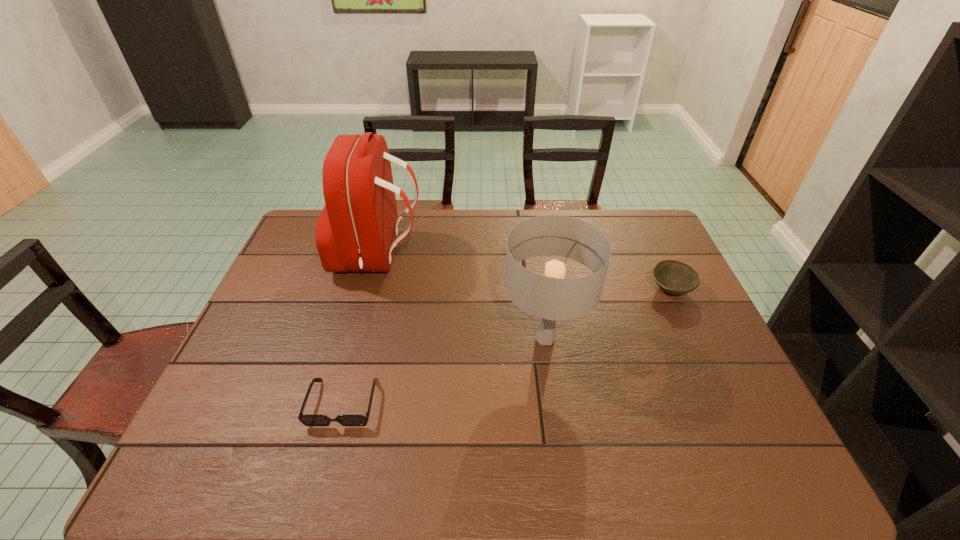
Find the location of a particular element. The width and height of the screenshot is (960, 540). vacant space that is in between the shortest object and the rightmost object is located at coordinates (507, 346).

Find the location of a particular element. The width and height of the screenshot is (960, 540). vacant space that's between the backpack and the sunglasses is located at coordinates (361, 329).

Find the location of a particular element. The image size is (960, 540). free spot between the tallest object and the third object from left to right is located at coordinates (462, 298).

The height and width of the screenshot is (540, 960). Find the location of `free space that is in between the sunglasses and the third tallest object`. free space that is in between the sunglasses and the third tallest object is located at coordinates (507, 346).

Locate an element on the screen. The image size is (960, 540). vacant region between the bowl and the third shortest object is located at coordinates (608, 314).

You are a GUI agent. You are given a task and a screenshot of the screen. Output one action in this format:
    pyautogui.click(x=<x>, y=<y>)
    Task: Click on the free point between the bowl and the nearest object
    This screenshot has width=960, height=540.
    Given the screenshot: What is the action you would take?
    pyautogui.click(x=507, y=346)

Locate an element on the screen. object identified as the third closest to the rightmost object is located at coordinates (308, 420).

This screenshot has height=540, width=960. In order to click on object that stands as the second closest to the bowl in this screenshot , I will do `click(357, 231)`.

Locate an element on the screen. The width and height of the screenshot is (960, 540). vacant area that satisfies the following two spatial constraints: 1. on the front-facing side of the lampshade; 2. on the front-facing side of the sunglasses is located at coordinates (554, 402).

Identify the location of blank area in the image that satisfies the following two spatial constraints: 1. on the strap side of the third tallest object; 2. on the right side of the tallest object. (370, 289).